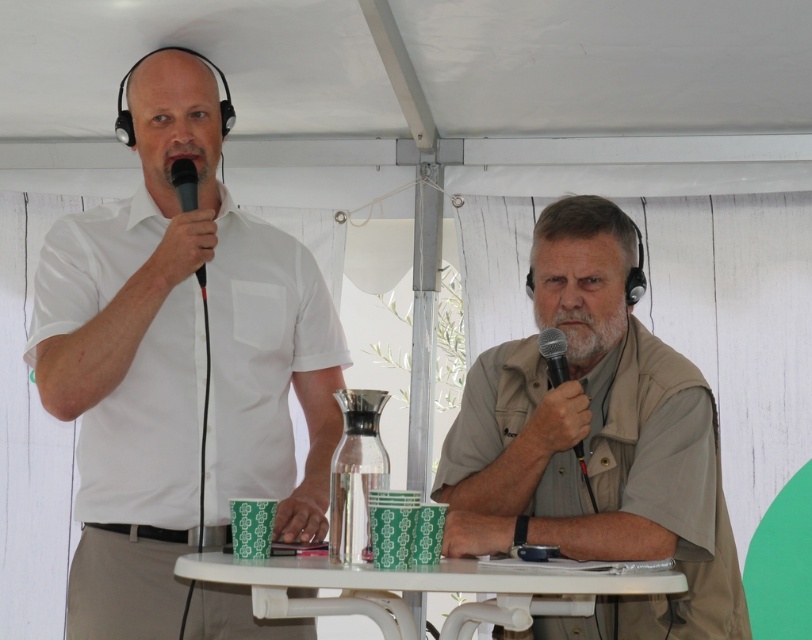
Question: Which point is farther to the camera?

Choices:
 (A) white plastic table at center
 (B) black matte microphone at center

Answer: (B)

Question: Does black matte microphone at center appear on the left side of black matte microphone at left?

Choices:
 (A) no
 (B) yes

Answer: (A)

Question: Among these points, which one is farthest from the camera?

Choices:
 (A) (560, 330)
 (B) (253, 448)

Answer: (B)

Question: Considering the real-world distances, which object is closest to the black matte microphone at center?

Choices:
 (A) beige fabric vest at center
 (B) black matte microphone at left
 (C) white plastic table at center
 (D) white matte shirt at left

Answer: (A)

Question: Can you confirm if beige fabric vest at center is positioned to the right of black matte microphone at center?

Choices:
 (A) no
 (B) yes

Answer: (B)

Question: Is white plastic table at center bigger than black matte microphone at left?

Choices:
 (A) yes
 (B) no

Answer: (A)